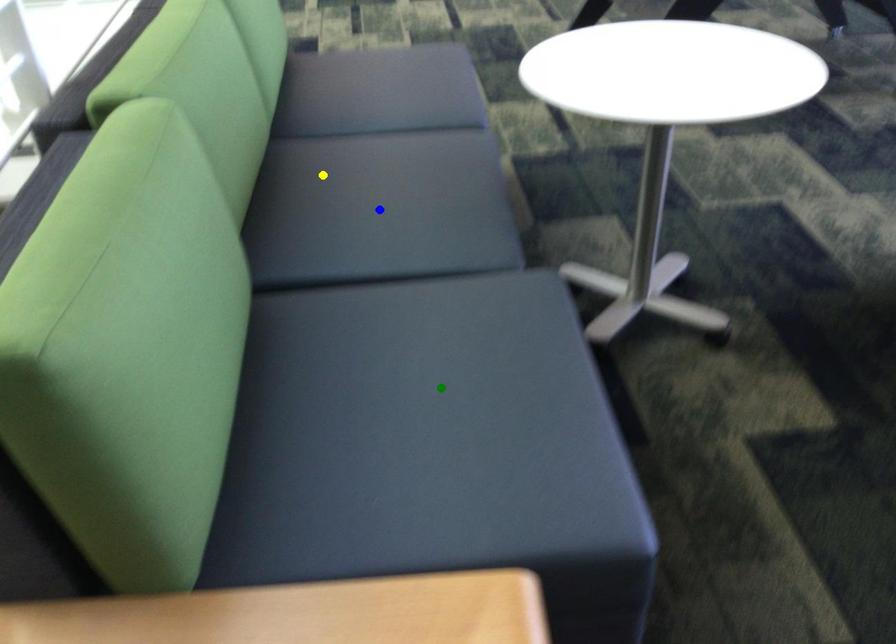
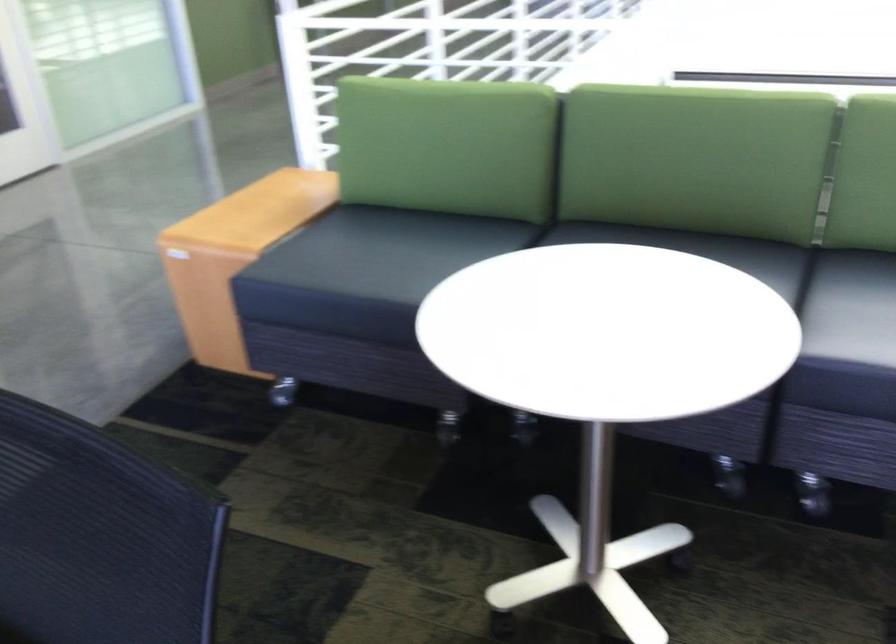
I am providing you with two images of the same scene from different viewpoints. Three points are marked in image1. Which point corresponds to a part or object that is occluded in image2?In image1, three points are marked. Which of them correspond to a part or object that is occluded in image2?Among the three points shown in image1, which one corresponds to a part or object that is no longer visible due to occlusion in image2?

blue point